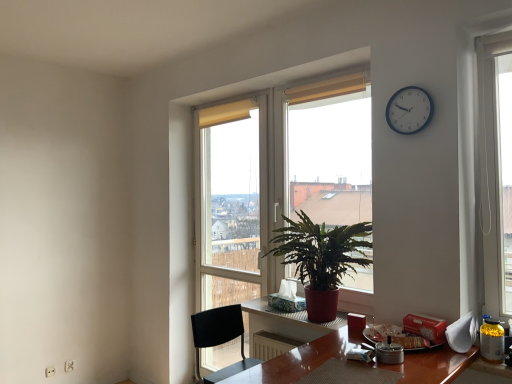
Where is `free spot above green leafy plant at center (from a real-world perspective)`? The height and width of the screenshot is (384, 512). free spot above green leafy plant at center (from a real-world perspective) is located at coordinates (321, 77).